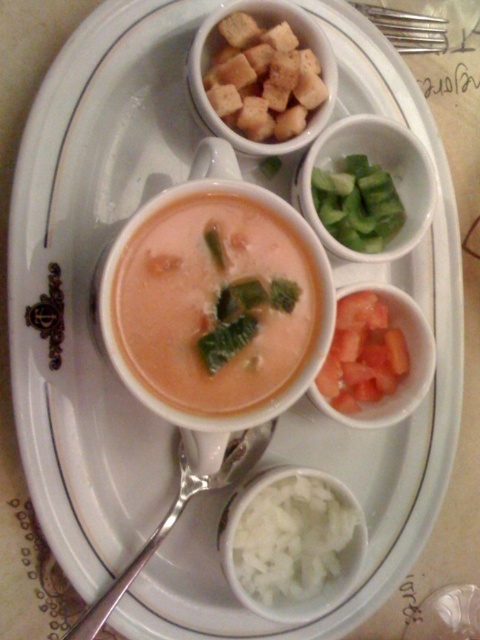
How distant is smooth creamy tomato soup at center from greencutcucumber at right?

A distance of 9.64 inches exists between smooth creamy tomato soup at center and greencutcucumber at right.

Locate an element on the screen. This screenshot has width=480, height=640. smooth creamy tomato soup at center is located at coordinates (215, 305).

Can you confirm if greencutcucumber at right is positioned above green cucumber at upper right?

Indeed, greencutcucumber at right is positioned over green cucumber at upper right.

Is greencutcucumber at right behind green cucumber at upper right?

No, it is not.

Is point (414, 186) positioned behind point (387, 243)?

No, it is in front of (387, 243).

Where is `greencutcucumber at right`? greencutcucumber at right is located at coordinates (383, 168).

Between brown croutons at upper center and tomato-red glass bowl at upper right, which one has less height?

Standing shorter between the two is brown croutons at upper center.

Is brown croutons at upper center behind tomato-red glass bowl at upper right?

No, it is in front of tomato-red glass bowl at upper right.

The height and width of the screenshot is (640, 480). What do you see at coordinates (264, 80) in the screenshot? I see `brown croutons at upper center` at bounding box center [264, 80].

Locate an element on the screen. brown croutons at upper center is located at coordinates (264, 80).